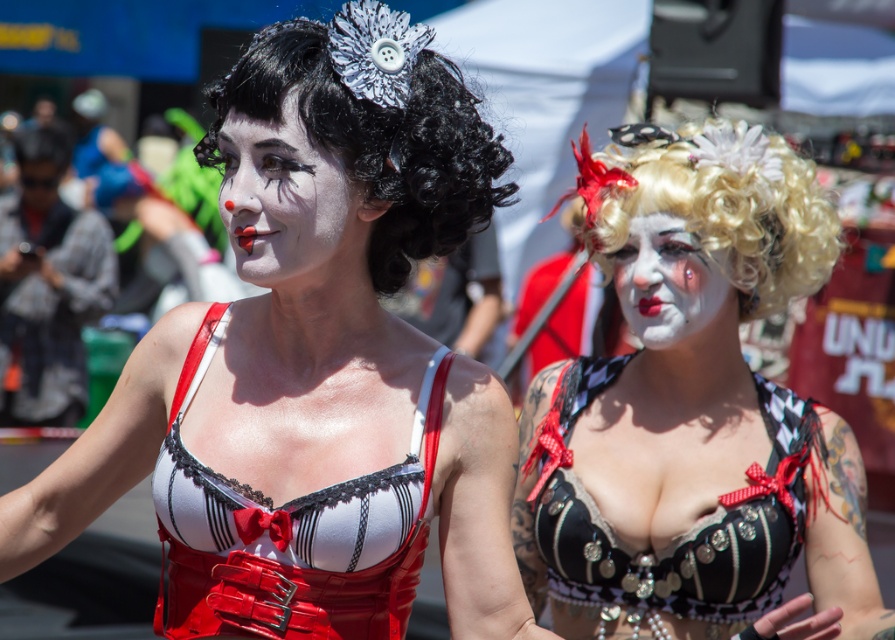
Who is lower down, matte black bra at center or matte white face at center?

matte black bra at center is lower down.

Find the location of a particular element. The width and height of the screenshot is (895, 640). matte black bra at center is located at coordinates (693, 412).

I want to click on matte black bra at center, so click(693, 412).

Which of these two, black leather bra at center or white matte face at center, stands shorter?

With less height is white matte face at center.

This screenshot has width=895, height=640. I want to click on black leather bra at center, so click(x=679, y=534).

Does matte black corset at center have a smaller size compared to black leather bra at center?

No, matte black corset at center is not smaller than black leather bra at center.

Who is more forward, (344, 387) or (716, 561)?

Positioned in front is point (344, 387).

The width and height of the screenshot is (895, 640). I want to click on matte black corset at center, so click(295, 289).